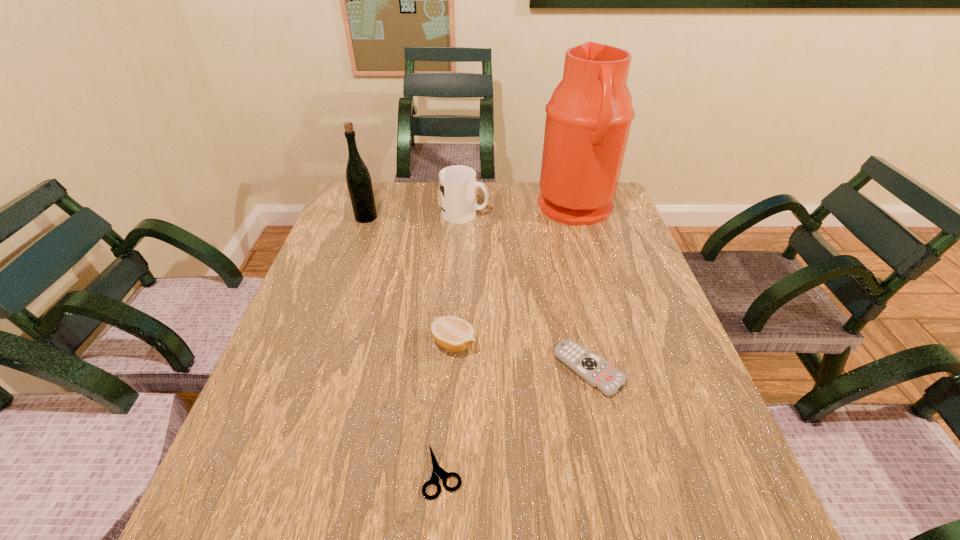
In the image, there is a desktop. Where is `vacant space at the near left corner`? The width and height of the screenshot is (960, 540). vacant space at the near left corner is located at coordinates (264, 497).

You are a GUI agent. You are given a task and a screenshot of the screen. Output one action in this format:
    pyautogui.click(x=<x>, y=<y>)
    Task: Click on the vacant area at the near right corner of the desktop
    This screenshot has width=960, height=540.
    Given the screenshot: What is the action you would take?
    pyautogui.click(x=691, y=496)

Identify the location of free space between the shears and the beer bottle. This screenshot has width=960, height=540. (404, 344).

Where is `free space between the water jug and the shortest object`? This screenshot has width=960, height=540. free space between the water jug and the shortest object is located at coordinates (510, 340).

This screenshot has height=540, width=960. I want to click on vacant space that is in between the second shortest object and the lemon, so click(x=521, y=356).

Locate an element on the screen. Image resolution: width=960 pixels, height=540 pixels. free space between the mug and the third shortest object is located at coordinates (460, 279).

Locate an element on the screen. This screenshot has height=540, width=960. empty space between the remote control and the shears is located at coordinates 516,420.

At what (x,y) coordinates should I click in order to perform the action: click on vacant area that lies between the nearest object and the fifth shortest object. Please return your answer as a coordinate pair (x, y). The height and width of the screenshot is (540, 960). Looking at the image, I should click on (404, 344).

I want to click on empty space that is in between the second shortest object and the beer bottle, so tap(477, 293).

At what (x,y) coordinates should I click in order to perform the action: click on vacant space in between the tallest object and the remote control. Please return your answer as a coordinate pair (x, y). This screenshot has height=540, width=960. Looking at the image, I should click on (583, 289).